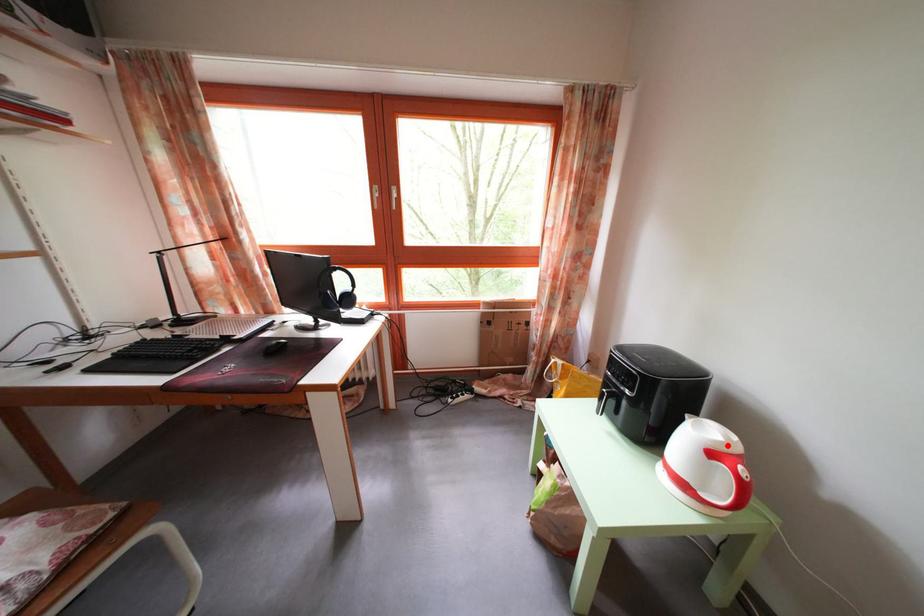
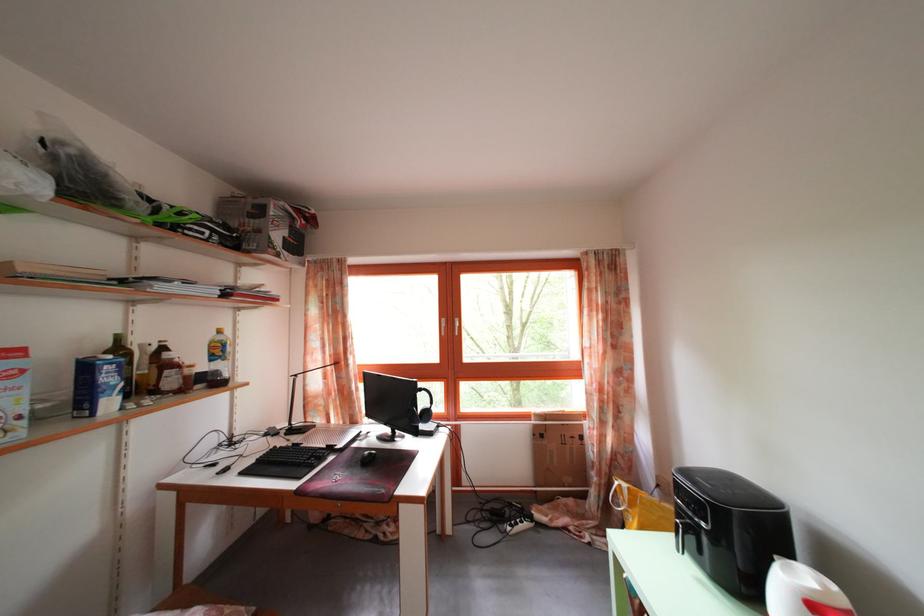
Question: I am providing you with two images of the same scene from different viewpoints. In image1, a red point is highlighted. Considering the same 3D point in image2, which of the following is correct?

Choices:
 (A) It is closer
 (B) It is farther

Answer: (A)